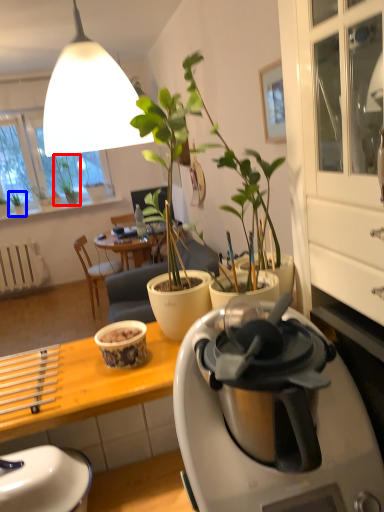
Question: Among these objects, which one is farthest to the camera, houseplant (highlighted by a red box) or houseplant (highlighted by a blue box)?

Choices:
 (A) houseplant
 (B) houseplant

Answer: (A)